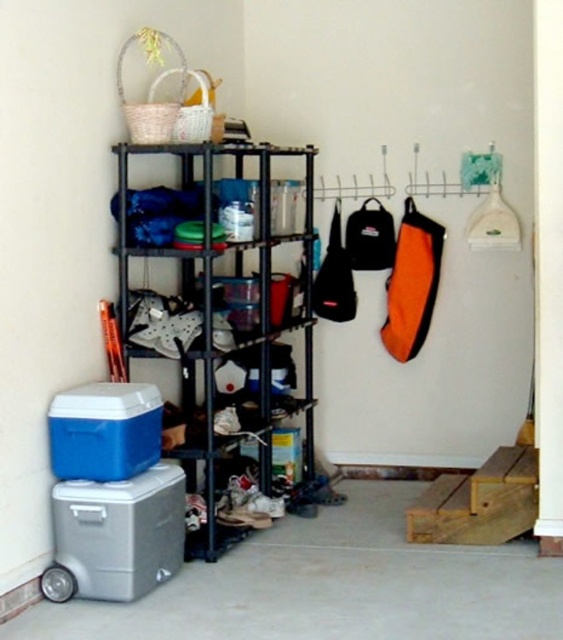
Consider the image. Does gray plastic cooler at lower left appear over blue plastic cooler at lower left?

No.

Between gray plastic cooler at lower left and blue plastic cooler at lower left, which one has more height?

With more height is gray plastic cooler at lower left.

Where is `gray plastic cooler at lower left`? gray plastic cooler at lower left is located at coordinates 115,536.

Where is `gray plastic cooler at lower left`? This screenshot has width=563, height=640. gray plastic cooler at lower left is located at coordinates (115, 536).

Does black metal shelf at center have a larger size compared to blue plastic cooler at lower left?

Yes, black metal shelf at center is bigger than blue plastic cooler at lower left.

Is point (218, 545) positioned after point (122, 424)?

Yes, point (218, 545) is behind point (122, 424).

The width and height of the screenshot is (563, 640). I want to click on black metal shelf at center, so click(229, 321).

Can you confirm if black metal shelf at center is positioned to the left of gray plastic cooler at lower left?

No, black metal shelf at center is not to the left of gray plastic cooler at lower left.

Describe the element at coordinates (229, 321) in the screenshot. I see `black metal shelf at center` at that location.

Is point (294, 156) more distant than point (60, 548)?

Yes, point (294, 156) is behind point (60, 548).

This screenshot has height=640, width=563. In order to click on black metal shelf at center in this screenshot , I will do `click(229, 321)`.